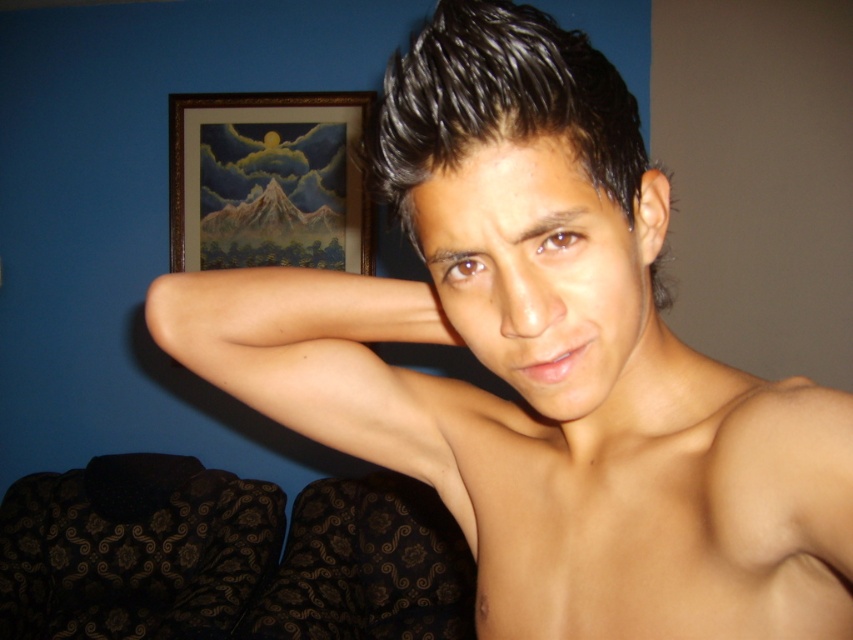
You are standing in the room looking at the blue wall with the mountain artwork. There are two points marked on the wall at coordinates point (471, 102) and point (321, 104). Which point is closer to you?

Point (471, 102) is closer to the viewer than point (321, 104).

You are an artist trying to paint the person in the image. You need to focus on the area where the skinny white skin at center is located. What are the coordinates of the point where you should focus your brush?

The coordinates of the point where you should focus your brush are at 0.798 in the x direction and 0.771 in the y direction.

You are a photographer adjusting your camera settings in a studio. You need to capture a portrait of the person with their black shiny hair at center and the wooden frame at upper center in focus. The camera can only focus on objects within a 5 feet range. Will both objects be in focus?

The black shiny hair at center is 6.56 feet away from the wooden frame at upper center. Since the camera can only focus on objects within a 5 feet range, the distance between them exceeds the focus range. Therefore, both objects cannot be in focus simultaneously.